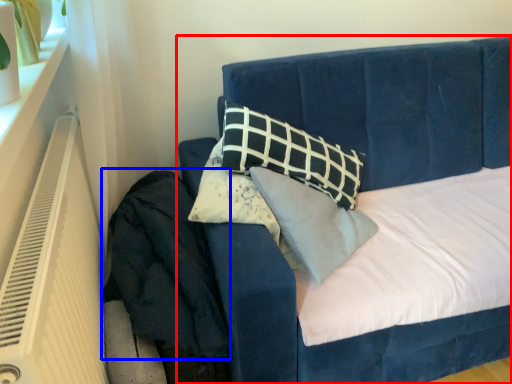
Question: Which of the following is the closest to the observer, bed (highlighted by a red box) or velvet (highlighted by a blue box)?

Choices:
 (A) bed
 (B) velvet

Answer: (A)